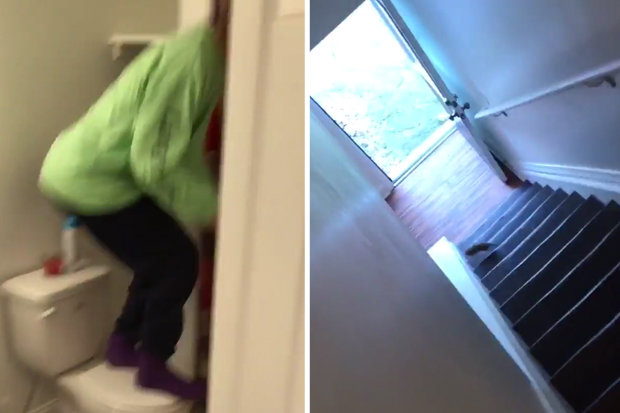
You are a GUI agent. You are given a task and a screenshot of the screen. Output one action in this format:
    pyautogui.click(x=<x>, y=<y>)
    Task: Click on the door
    This screenshot has height=413, width=620.
    Given the screenshot: What is the action you would take?
    pyautogui.click(x=470, y=135)